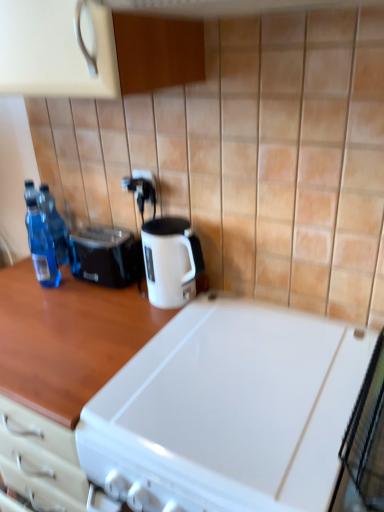
Identify the location of vacant space in between black plastic toaster at left and transparent plastic bottles at left, positioned as the second bottle in back-to-front order. The height and width of the screenshot is (512, 384). (76, 282).